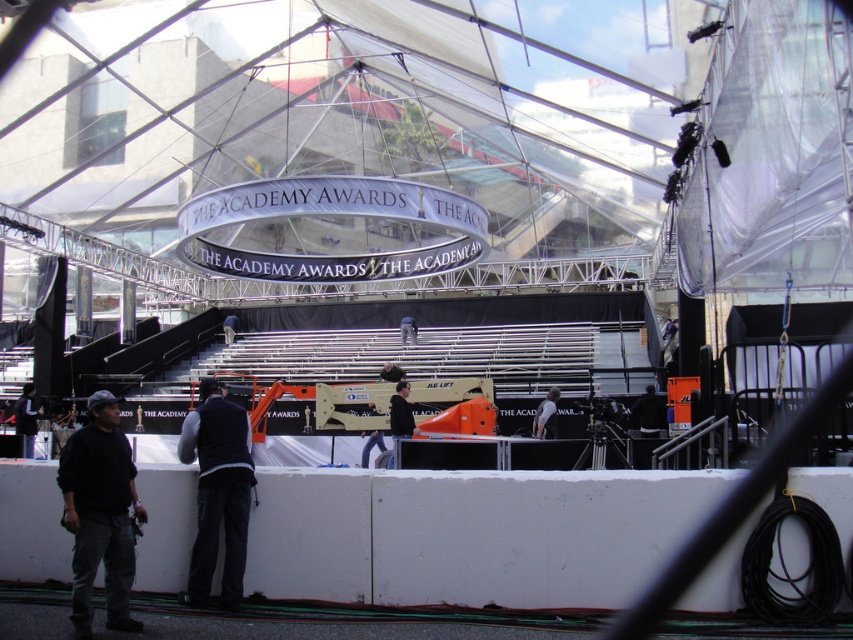
Question: Among these objects, which one is nearest to the camera?

Choices:
 (A) black fabric vest at lower left
 (B) white matte barrier at lower center

Answer: (B)

Question: Considering the real-world distances, which object is farthest from the white matte barrier at lower center?

Choices:
 (A) dark gray fabric jacket at lower left
 (B) black matte jacket at center

Answer: (B)

Question: Does black fabric vest at lower left have a smaller size compared to black matte jacket at center?

Choices:
 (A) yes
 (B) no

Answer: (B)

Question: Can you confirm if white matte barrier at lower center is positioned above dark gray fabric jacket at lower left?

Choices:
 (A) yes
 (B) no

Answer: (A)

Question: Estimate the real-world distances between objects in this image. Which object is closer to the black fabric vest at lower left?

Choices:
 (A) dark gray fabric jacket at lower left
 (B) white matte barrier at lower center

Answer: (A)

Question: Considering the relative positions of dark gray fabric jacket at lower left and black matte jacket at center in the image provided, where is dark gray fabric jacket at lower left located with respect to black matte jacket at center?

Choices:
 (A) above
 (B) below

Answer: (B)